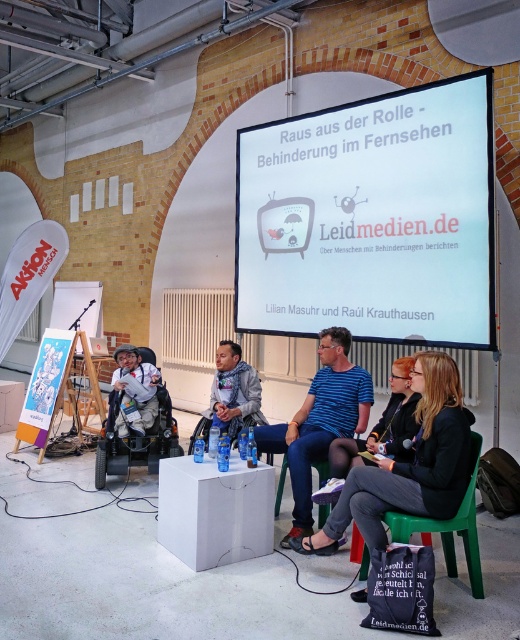
Question: Which of the following is the farthest from the observer?

Choices:
 (A) (193, 436)
 (B) (463, 445)
 (C) (388, 189)
 (D) (123, 378)

Answer: (D)

Question: Can you confirm if white glossy projection screen at upper center is wider than white plastic chair at center?

Choices:
 (A) no
 (B) yes

Answer: (B)

Question: Considering the relative positions of white glossy projection screen at upper center and matte black jacket at center in the image provided, where is white glossy projection screen at upper center located with respect to matte black jacket at center?

Choices:
 (A) below
 (B) above

Answer: (B)

Question: Where is green plastic chair at lower right located in relation to light brown textured wheelchair at left in the image?

Choices:
 (A) right
 (B) left

Answer: (A)

Question: Considering the real-world distances, which object is closest to the matte gray wheelchair at center?

Choices:
 (A) white glossy projection screen at upper center
 (B) light brown textured wheelchair at left
 (C) white plastic chair at center
 (D) green plastic chair at lower right

Answer: (C)

Question: Which of these objects is positioned farthest from the white glossy projection screen at upper center?

Choices:
 (A) matte black jacket at center
 (B) white plastic chair at center
 (C) blue striped shirt at center
 (D) matte gray wheelchair at center

Answer: (B)